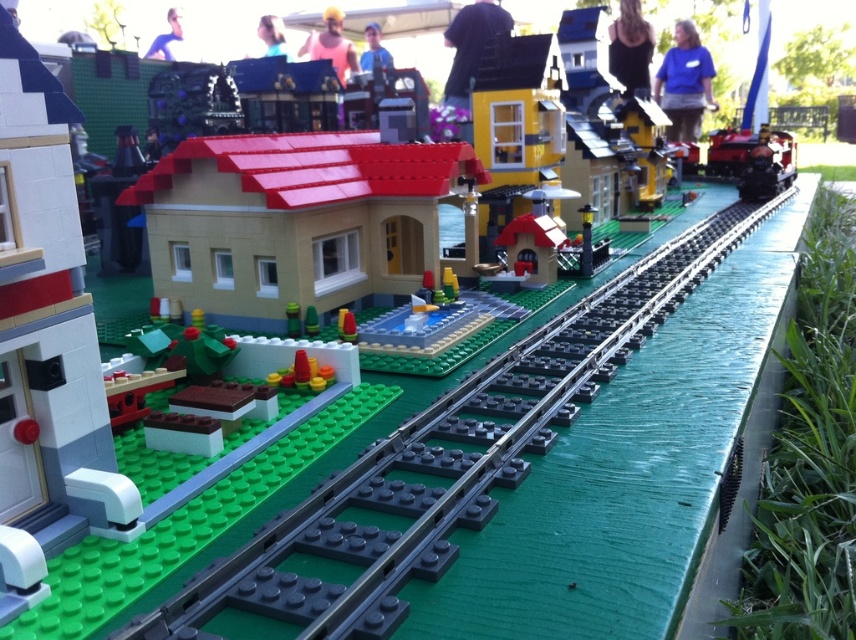
Question: Is blue fabric shirt at upper right bigger than blue fabric shirt at upper center?

Choices:
 (A) no
 (B) yes

Answer: (B)

Question: Does matte black hat at upper center have a smaller size compared to blonde hair at upper center?

Choices:
 (A) yes
 (B) no

Answer: (B)

Question: Which object appears farthest from the camera in this image?

Choices:
 (A) black tank top at upper center
 (B) blue shirt at upper center
 (C) blue fabric shirt at upper center
 (D) matte black hat at upper center

Answer: (C)

Question: Which object is positioned farthest from the shiny red train at right?

Choices:
 (A) blonde hair at upper center
 (B) blue shirt at upper center
 (C) pink fabric shirt at upper center

Answer: (B)

Question: Which point is closer to the camera?

Choices:
 (A) (369, 29)
 (B) (691, 83)
 (C) (336, 10)

Answer: (C)

Question: Is blue fabric shirt at upper right to the left of blue fabric shirt at upper center from the viewer's perspective?

Choices:
 (A) no
 (B) yes

Answer: (A)